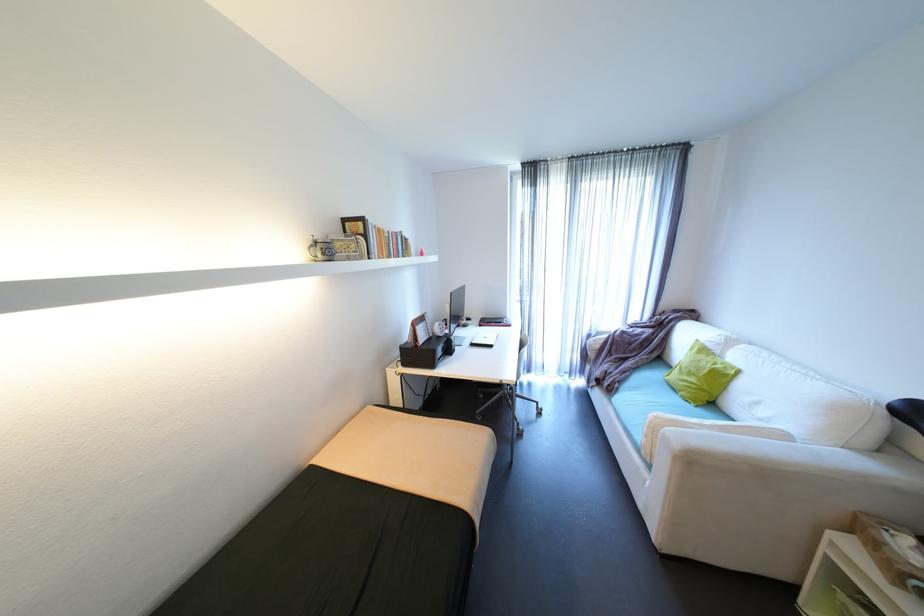
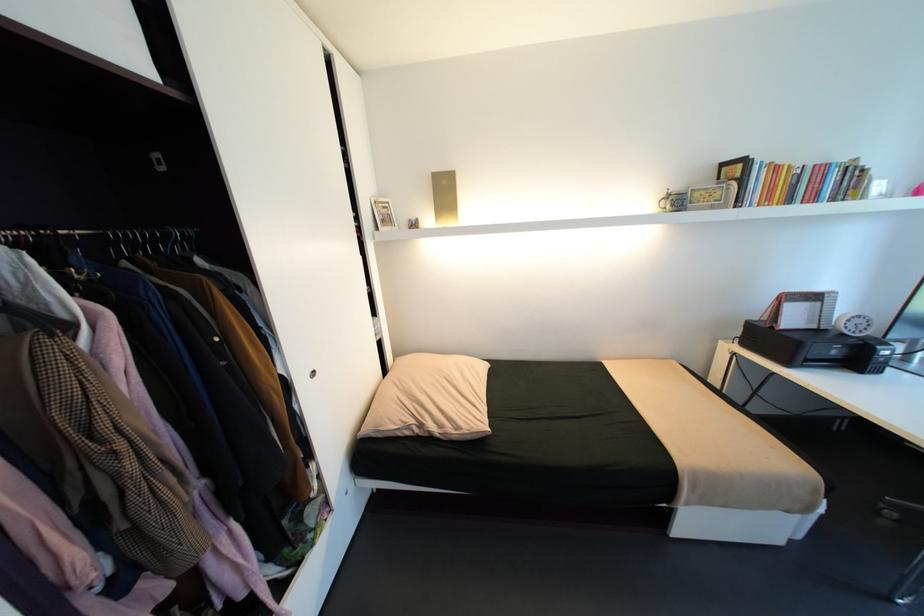
The point at (398,233) is marked in the first image. Where is the corresponding point in the second image?

(821, 166)